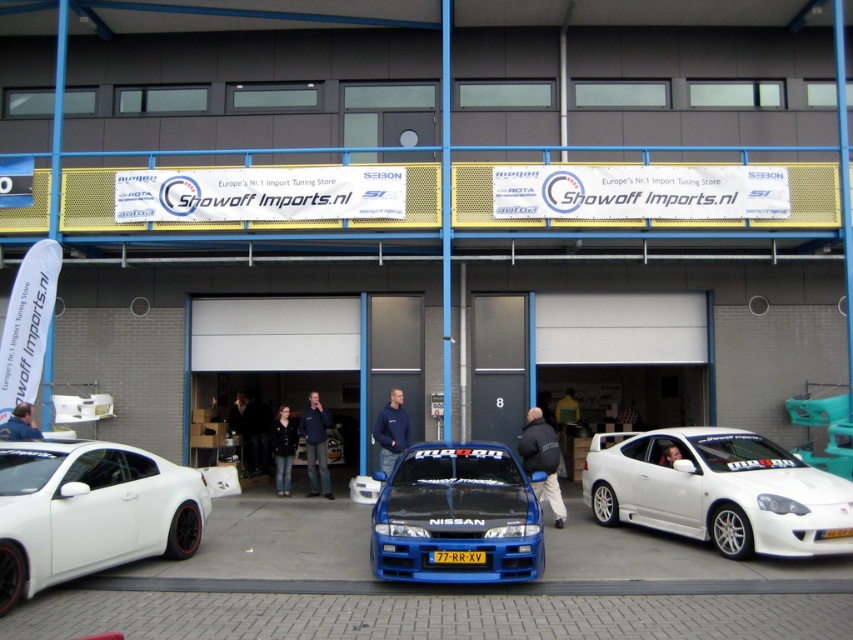
Is white glossy car at center wider than yellow matte license plate at center?

Yes, white glossy car at center is wider than yellow matte license plate at center.

Does white glossy car at center have a lesser height compared to yellow matte license plate at center?

No, white glossy car at center is not shorter than yellow matte license plate at center.

Find the location of a particular element. Image resolution: width=853 pixels, height=640 pixels. white glossy car at center is located at coordinates (718, 492).

Where is `white glossy car at center`? white glossy car at center is located at coordinates (718, 492).

Identify the location of white matte car at lower left. The width and height of the screenshot is (853, 640). (90, 512).

Can you confirm if white matte car at lower left is positioned to the right of yellow matte license plate at center?

No, white matte car at lower left is not to the right of yellow matte license plate at center.

Where is `white matte car at lower left`? This screenshot has height=640, width=853. white matte car at lower left is located at coordinates (90, 512).

Find the location of `white matte car at lower left`. white matte car at lower left is located at coordinates (90, 512).

Is white glossy car at center bigger than white matte car at lower left?

Correct, white glossy car at center is larger in size than white matte car at lower left.

Which is below, white glossy car at center or white matte car at lower left?

Positioned lower is white glossy car at center.

Find the location of a particular element. white glossy car at center is located at coordinates (718, 492).

The image size is (853, 640). In order to click on white glossy car at center in this screenshot , I will do `click(718, 492)`.